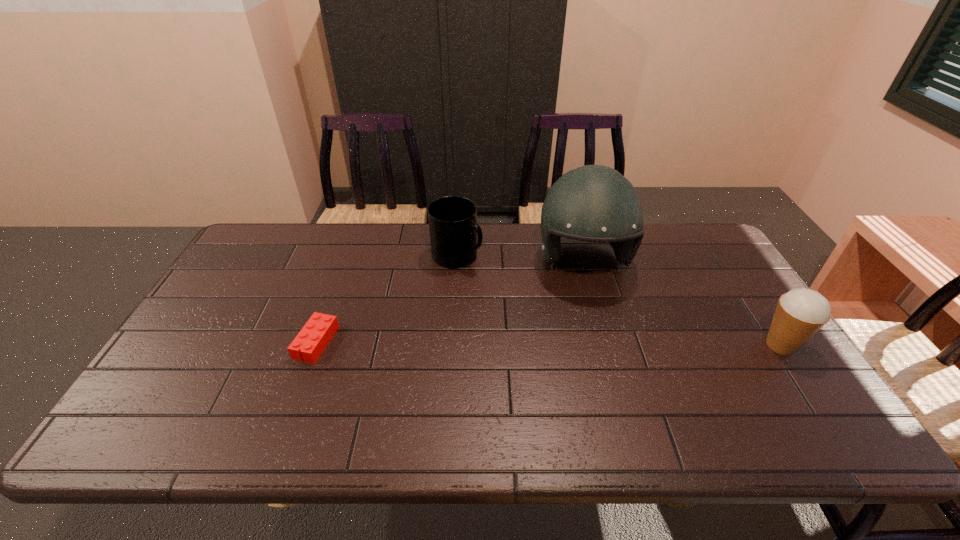
I want to click on the shortest object, so click(x=313, y=338).

Locate an element on the screen. This screenshot has height=540, width=960. Lego is located at coordinates (313, 338).

What are the coordinates of `icecream` in the screenshot? It's located at (800, 313).

Locate an element on the screen. This screenshot has height=540, width=960. the tallest object is located at coordinates (594, 203).

Locate an element on the screen. The height and width of the screenshot is (540, 960). football helmet is located at coordinates (594, 203).

The width and height of the screenshot is (960, 540). I want to click on the second object from left to right, so click(453, 227).

Identify the location of vacant space located 0.260m on the left of the Lego. (201, 342).

Locate an element on the screen. The image size is (960, 540). vacant point located 0.200m on the left of the icecream is located at coordinates (684, 345).

Identify the location of vacant region located 0.130m at the face opening of the second object from right to left. (599, 329).

I want to click on vacant region located 0.220m at the face opening of the second object from right to left, so click(x=606, y=355).